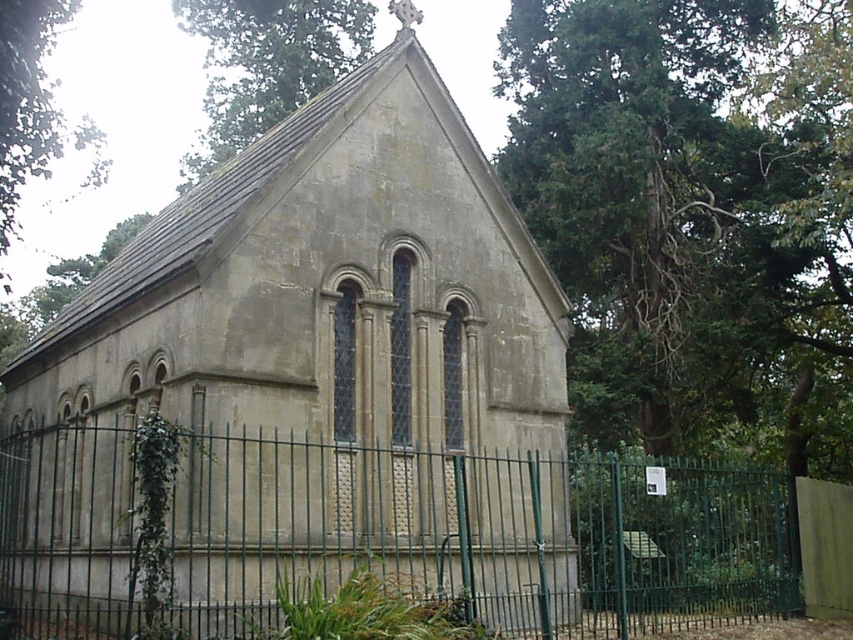
Question: Is matte stone church at center in front of green metal fence at lower center?

Choices:
 (A) yes
 (B) no

Answer: (B)

Question: Which object is the closest to the green leafy tree at upper left?

Choices:
 (A) green metal fence at lower center
 (B) green leafy tree at upper center

Answer: (B)

Question: Observing the image, what is the correct spatial positioning of green metal fence at lower center in reference to green leafy tree at upper left?

Choices:
 (A) below
 (B) above

Answer: (A)

Question: Does green leafy tree at upper center appear over green leafy tree at upper left?

Choices:
 (A) no
 (B) yes

Answer: (B)

Question: Which object appears closest to the camera in this image?

Choices:
 (A) green metal fence at lower center
 (B) green leafy tree at upper left
 (C) matte stone church at center
 (D) green leafy tree at upper center

Answer: (A)

Question: Which point appears closest to the camera in this image?

Choices:
 (A) (80, 145)
 (B) (302, 461)
 (C) (460, 568)
 (D) (248, 113)

Answer: (B)